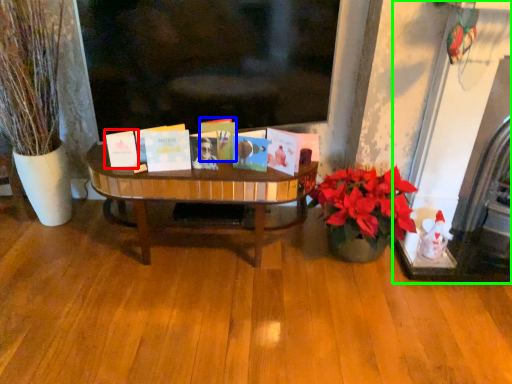
Question: Which is farther away from book (highlighted by a red box)? book (highlighted by a blue box) or fireplace (highlighted by a green box)?

Choices:
 (A) book
 (B) fireplace

Answer: (B)